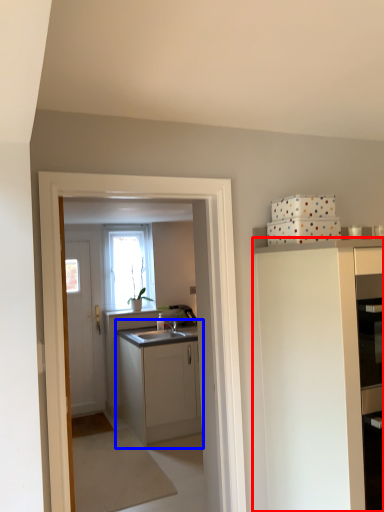
Question: Which of the following is the closest to the observer, cabinetry (highlighted by a red box) or cabinetry (highlighted by a blue box)?

Choices:
 (A) cabinetry
 (B) cabinetry

Answer: (A)